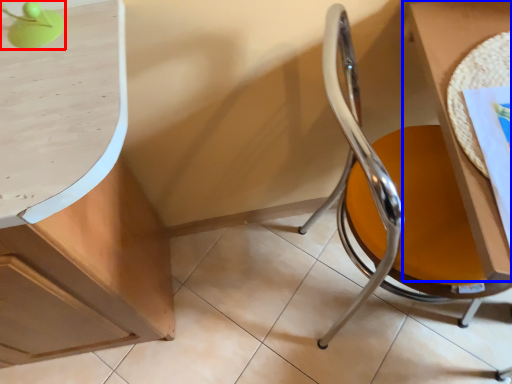
Question: Which object is closer to the camera taking this photo, table lamp (highlighted by a red box) or table (highlighted by a blue box)?

Choices:
 (A) table lamp
 (B) table

Answer: (A)